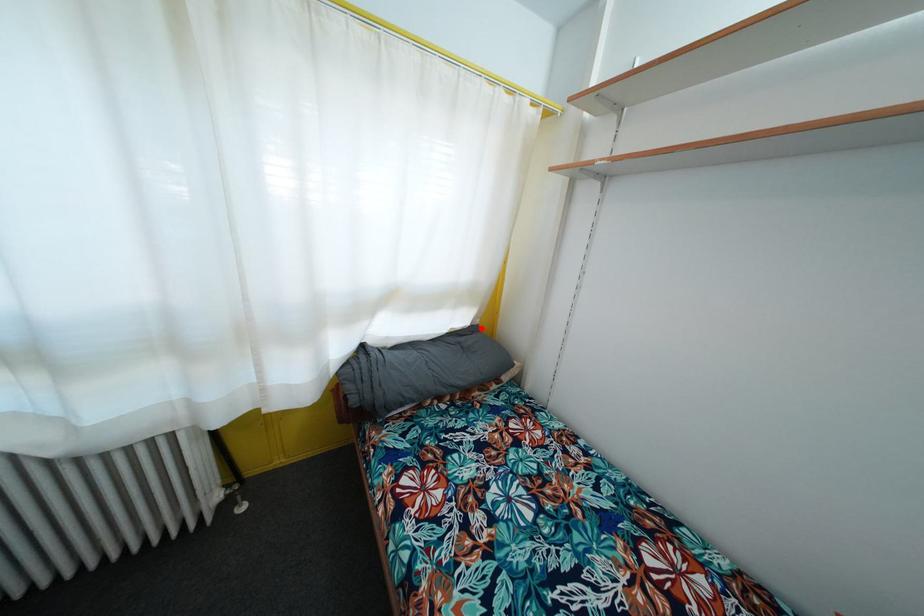
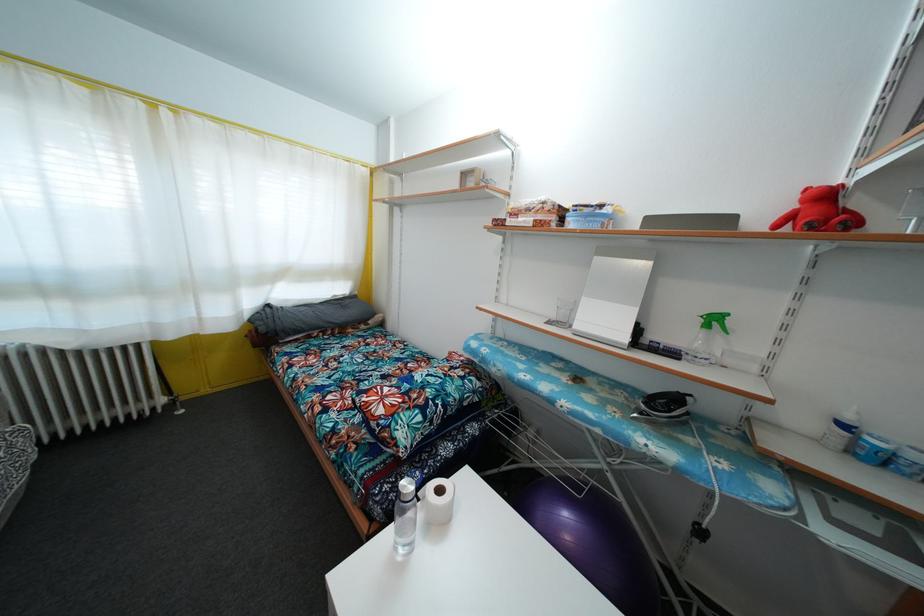
In the second image, find the point that corresponds to the highlighted location in the first image.

(359, 300)